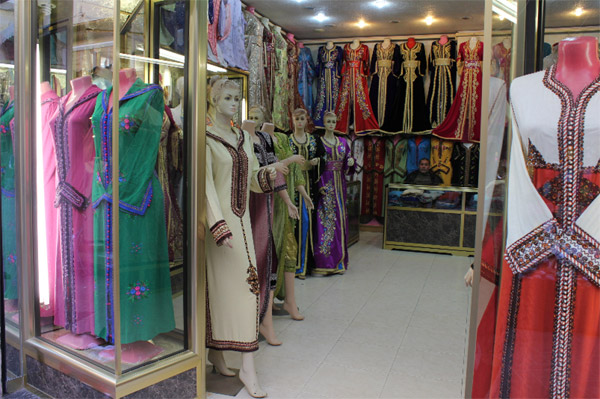
The width and height of the screenshot is (600, 399). I want to click on mannequins without heads, so click(x=268, y=129), click(x=251, y=127), click(x=577, y=67), click(x=125, y=79), click(x=76, y=86).